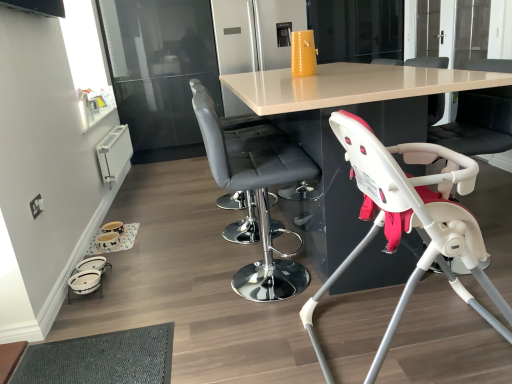
Find the location of `free space to the left of matte gray bar stool at center, positioned as the 4th chair in right-to-left order`. free space to the left of matte gray bar stool at center, positioned as the 4th chair in right-to-left order is located at coordinates (187, 236).